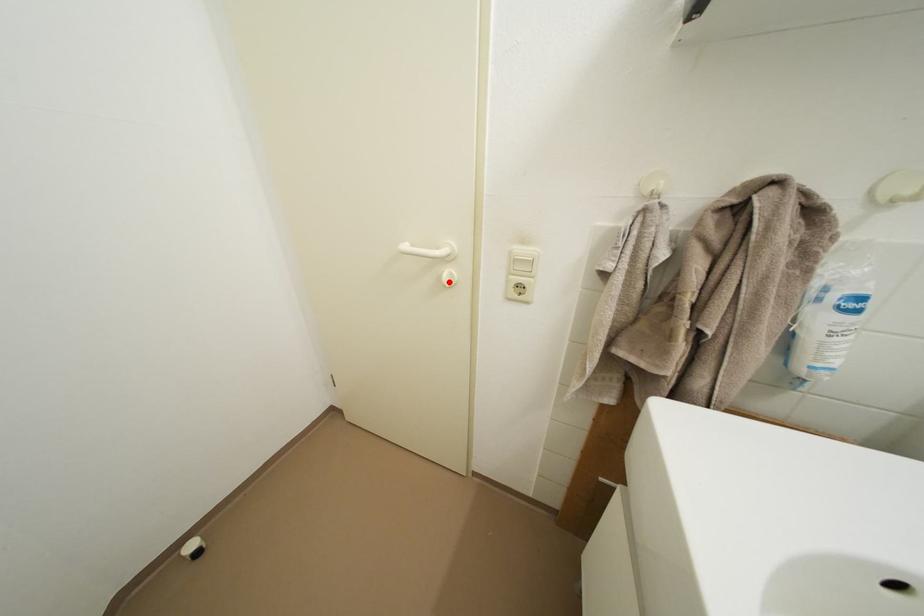
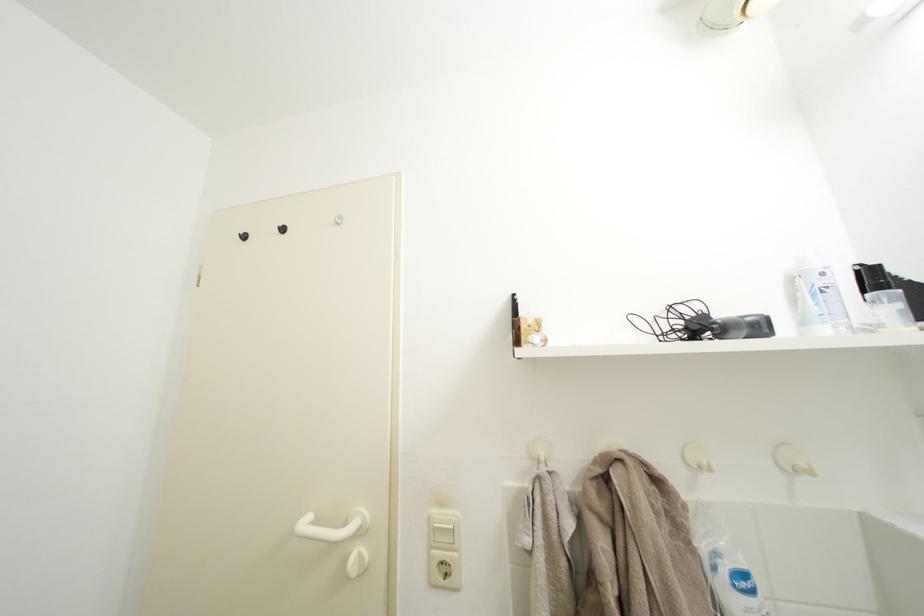
Find the pixel in the second image that matches the highlighted location in the first image.

(354, 565)